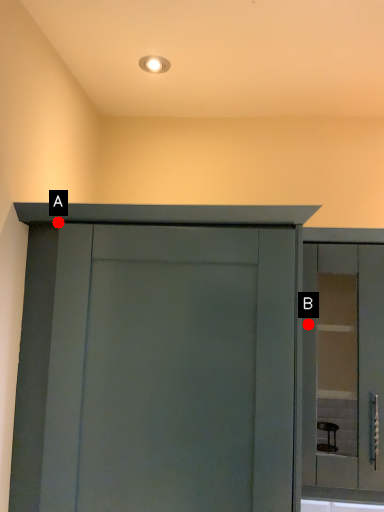
Question: Two points are circled on the image, labeled by A and B beside each circle. Which point appears closest to the camera in this image?

Choices:
 (A) A is closer
 (B) B is closer

Answer: (A)